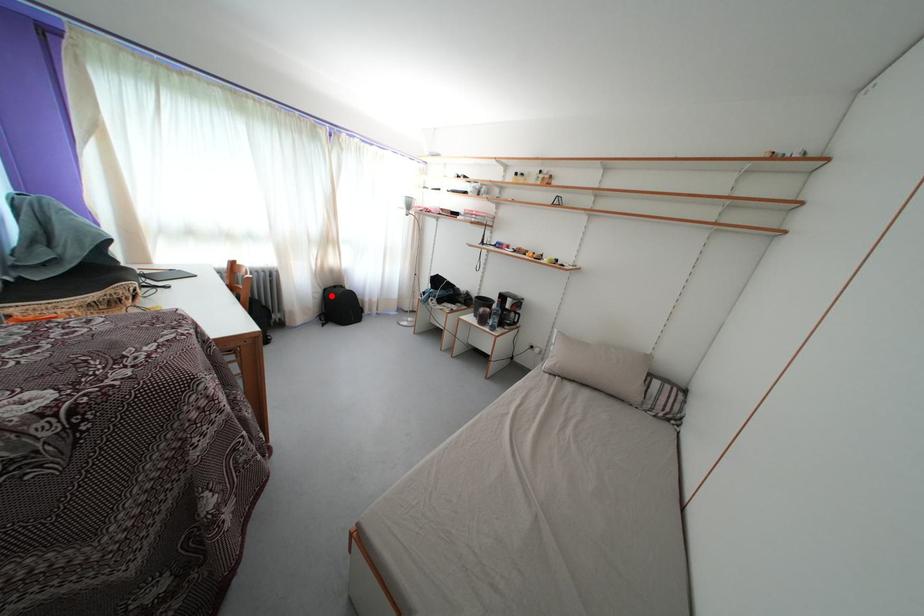
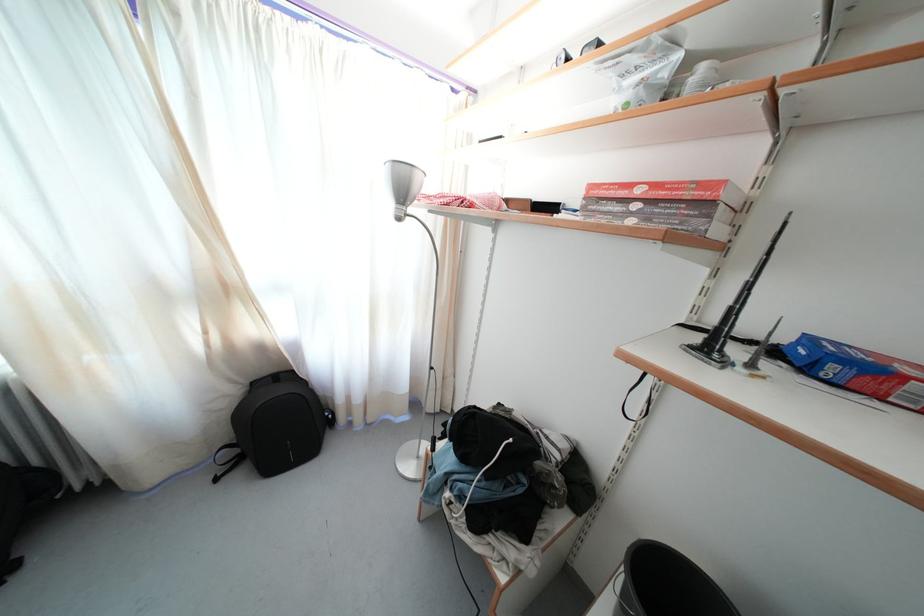
Question: I am providing you with two images of the same scene from different viewpoints. A red point is shown in image1. For the corresponding object point in image2, is it positioned nearer or farther from the camera?

Choices:
 (A) Nearer
 (B) Farther

Answer: (B)